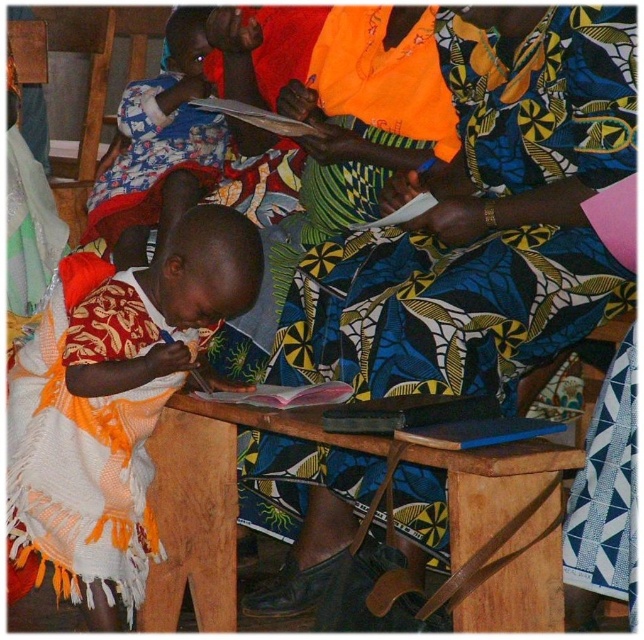
You are a teacher in a classroom and need to place a 1.2 meter long ruler between the wooden table at center and the printed fabric cloth at upper left. Is there enough space to place the ruler horizontally between them?

The wooden table at center is 1.15 meters away from the printed fabric cloth at upper left. Since the ruler is 1.2 meters long, which is slightly longer than the distance between the two objects, the ruler cannot be placed horizontally between them without overlapping either object.

You are organizing a craft activity for children and have two cloths available. The matte orange cloth at center and the printed fabric cloth at upper left. Which cloth should you choose if you need a wider piece for covering a large surface?

The matte orange cloth at center is wider than the printed fabric cloth at upper left, so you should choose the matte orange cloth at center for covering a large surface.